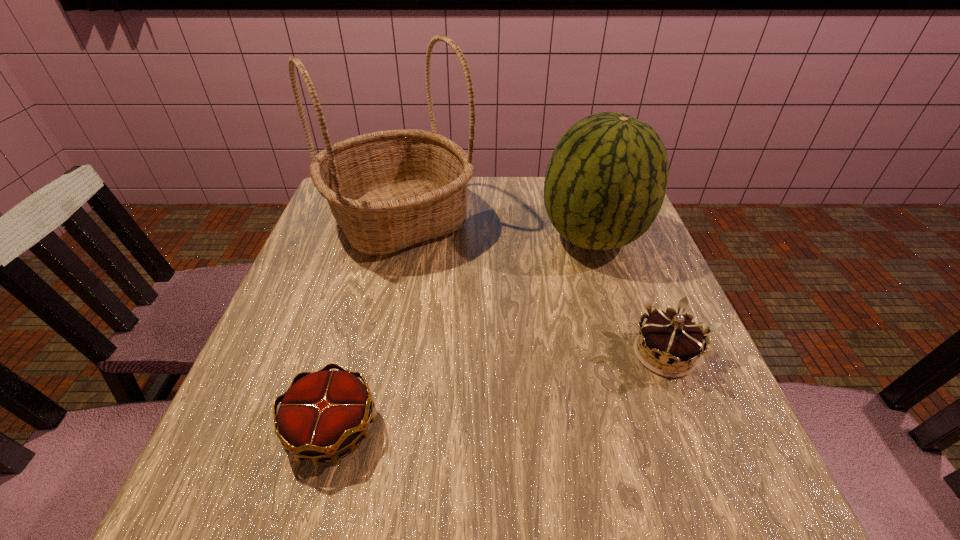
I want to click on vacant region between the tallest object and the left crown, so click(366, 324).

Locate an element on the screen. free space between the basket and the watermelon is located at coordinates (496, 228).

Where is `vacant area between the second tallest object and the basket`? Image resolution: width=960 pixels, height=540 pixels. vacant area between the second tallest object and the basket is located at coordinates (496, 228).

Locate an element on the screen. The height and width of the screenshot is (540, 960). vacant space that's between the third shortest object and the nearer crown is located at coordinates (463, 333).

Locate an element on the screen. The height and width of the screenshot is (540, 960). free space that is in between the basket and the third shortest object is located at coordinates (496, 228).

Where is `object identified as the closest to the tallest object`? The image size is (960, 540). object identified as the closest to the tallest object is located at coordinates (605, 183).

Find the location of a particular element. This screenshot has width=960, height=540. object that stands as the third closest to the basket is located at coordinates (671, 337).

I want to click on vacant space that satisfies the following two spatial constraints: 1. on the front side of the basket; 2. on the right side of the taller crown, so click(369, 354).

This screenshot has height=540, width=960. Identify the location of free space that satisfies the following two spatial constraints: 1. on the back side of the tallest object; 2. on the left side of the left crown. (388, 219).